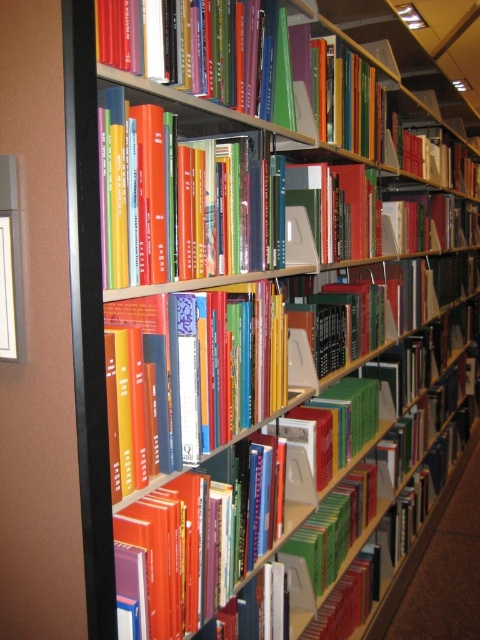
Question: Which of the following is the farthest from the observer?

Choices:
 (A) (256, 180)
 (B) (224, 422)

Answer: (A)

Question: Can you confirm if hardcover books at center is positioned to the right of hardcover book at center?

Choices:
 (A) no
 (B) yes

Answer: (A)

Question: Among these objects, which one is farthest from the camera?

Choices:
 (A) hardcover book at center
 (B) hardcover books at center

Answer: (A)

Question: Is the position of hardcover books at center more distant than that of hardcover book at center?

Choices:
 (A) no
 (B) yes

Answer: (A)

Question: Is hardcover books at center to the right of hardcover book at center from the viewer's perspective?

Choices:
 (A) yes
 (B) no

Answer: (B)